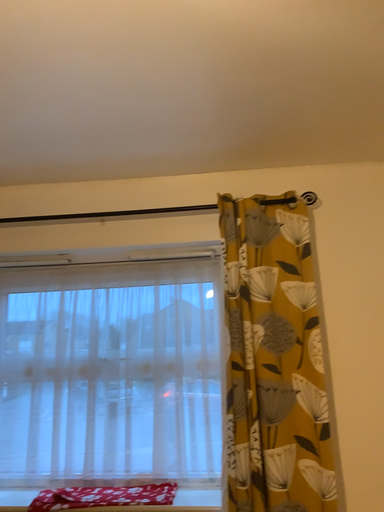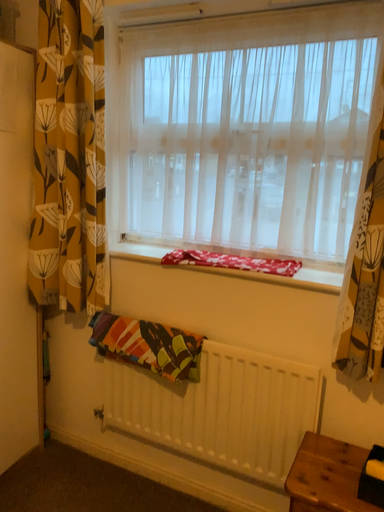
Question: Which way did the camera rotate in the video?

Choices:
 (A) rotated right
 (B) rotated left

Answer: (B)